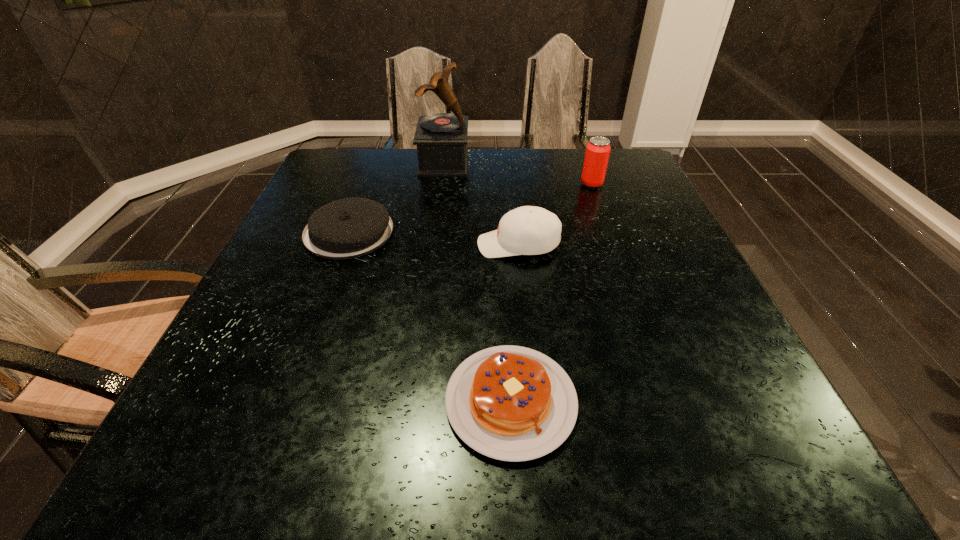
Locate an element on the screen. Image resolution: width=960 pixels, height=540 pixels. vacant space located 0.330m on the left of the rightmost object is located at coordinates (462, 184).

This screenshot has width=960, height=540. What are the coordinates of `vacant space located 0.120m on the front-facing side of the third tallest object` in the screenshot? It's located at tap(425, 245).

In order to click on blank space located 0.260m on the front-facing side of the third tallest object in this screenshot , I will do `click(364, 245)`.

This screenshot has height=540, width=960. I want to click on vacant space located on the front-facing side of the third tallest object, so click(420, 245).

Identify the location of vacant region located 0.070m on the front of the taller pancake. This screenshot has width=960, height=540. (330, 282).

Locate an element on the screen. This screenshot has height=540, width=960. vacant region located on the left of the shorter pancake is located at coordinates (402, 401).

The width and height of the screenshot is (960, 540). I want to click on phonograph_record at the far edge, so click(x=441, y=138).

Where is `beer can present at the far edge`? The height and width of the screenshot is (540, 960). beer can present at the far edge is located at coordinates (598, 149).

Find the location of a particular element. The height and width of the screenshot is (540, 960). object that is at the near edge is located at coordinates pos(511,403).

You are a GUI agent. You are given a task and a screenshot of the screen. Output one action in this format:
    pyautogui.click(x=<x>, y=<y>)
    Task: Click on the object situated at the left edge
    
    Given the screenshot: What is the action you would take?
    pyautogui.click(x=348, y=228)